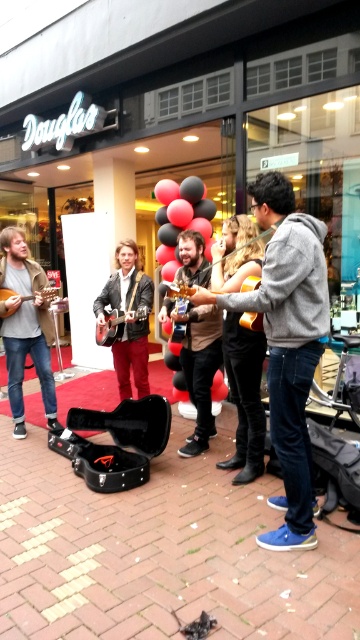
Question: Which of the following is the closest to the observer?

Choices:
 (A) (106, 404)
 (B) (212, 417)
 (C) (11, 262)
 (D) (168, 266)

Answer: (B)

Question: Does brown leather jacket at center appear on the left side of matte black guitar at center?

Choices:
 (A) no
 (B) yes

Answer: (A)

Question: Does gray hoodie at center appear on the right side of matte brown acoustic guitar at left?

Choices:
 (A) yes
 (B) no

Answer: (A)

Question: Among these points, which one is farthest from the camera?

Choices:
 (A) (198, 184)
 (B) (133, 323)
 (C) (96, 339)
 (D) (9, 356)

Answer: (A)

Question: Among these points, which one is nearest to the camera?

Choices:
 (A) (234, 524)
 (B) (32, 298)
 (C) (16, 387)

Answer: (A)

Question: From the image, what is the correct spatial relationship of gray hoodie at center in relation to matte gray jacket at left?

Choices:
 (A) right
 (B) left

Answer: (A)